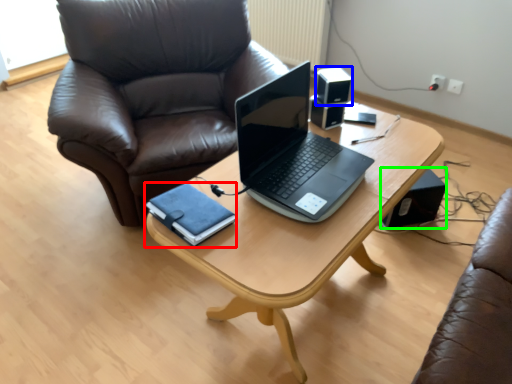
Question: Estimate the real-world distances between objects in this image. Which object is closer to notebook (highlighted by a red box), speaker (highlighted by a blue box) or speaker (highlighted by a green box)?

Choices:
 (A) speaker
 (B) speaker

Answer: (A)